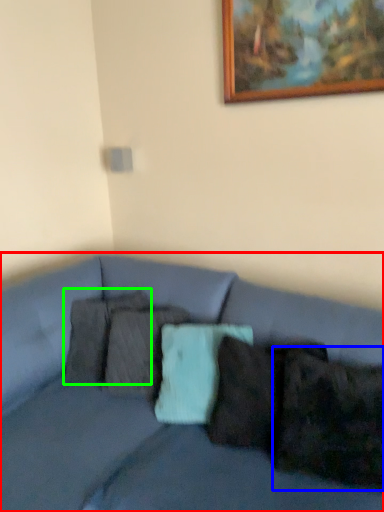
Question: Considering the real-world distances, which object is closest to studio couch (highlighted by a red box)? pillow (highlighted by a blue box) or pillow (highlighted by a green box).

Choices:
 (A) pillow
 (B) pillow

Answer: (B)